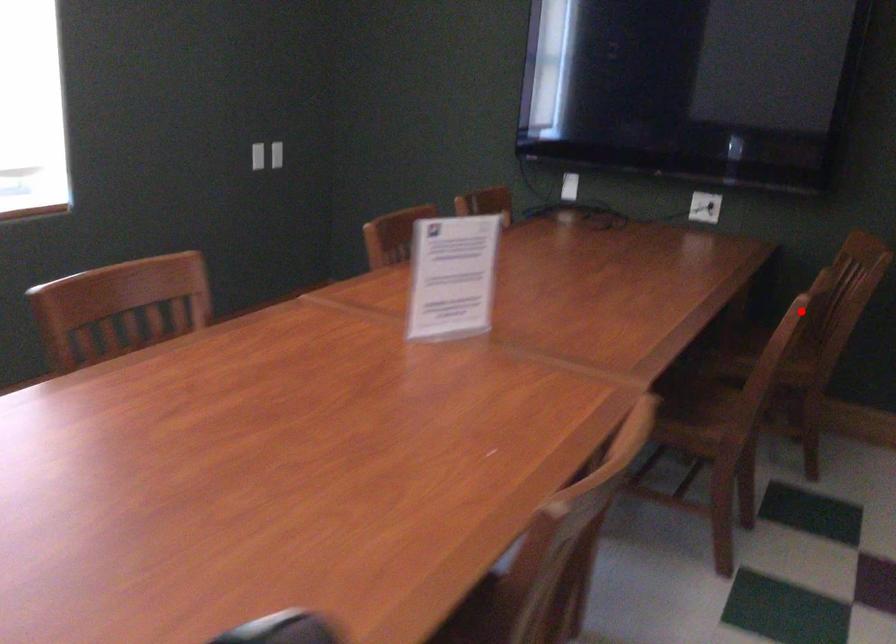
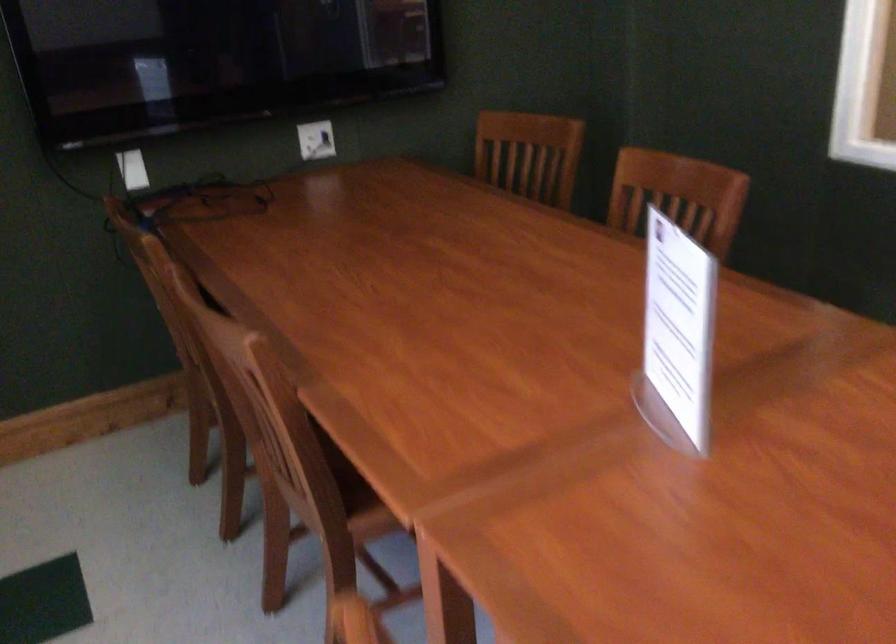
In the second image, find the point that corresponds to the highlighted location in the first image.

(677, 196)